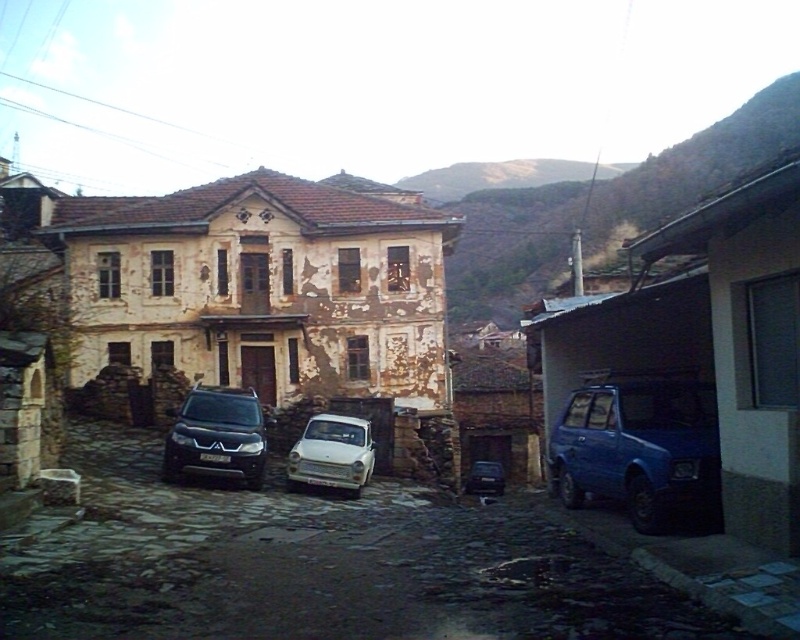
Question: Which object appears closest to the camera in this image?

Choices:
 (A) metallic blue sedan at center
 (B) smooth stone alley at center

Answer: (B)

Question: Is smooth stone alley at center smaller than blue matte car at right?

Choices:
 (A) no
 (B) yes

Answer: (A)

Question: Considering the relative positions of satin black suv at center and white matte car at center in the image provided, where is satin black suv at center located with respect to white matte car at center?

Choices:
 (A) above
 (B) below

Answer: (A)

Question: Among these points, which one is farthest from the camera?

Choices:
 (A) (333, 452)
 (B) (200, 433)
 (C) (106, 548)
 (D) (470, 470)

Answer: (D)

Question: Can you confirm if smooth stone alley at center is positioned to the right of blue matte car at right?

Choices:
 (A) yes
 (B) no

Answer: (B)

Question: Based on their relative distances, which object is nearer to the blue matte car at right?

Choices:
 (A) satin black suv at center
 (B) white matte car at center

Answer: (B)